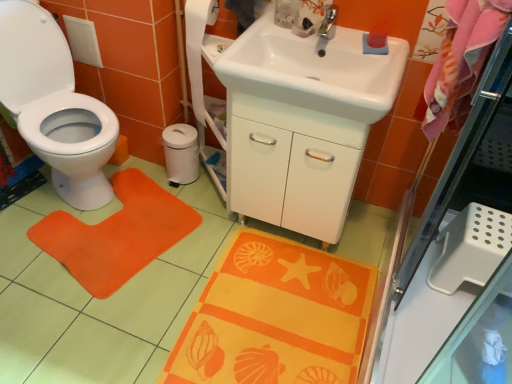
Question: Is white glossy sink at upper center, marked as the 2th sink in a back-to-front arrangement, with pink fabric beach towel at upper right?

Choices:
 (A) yes
 (B) no

Answer: (B)

Question: Does white glossy sink at upper center, marked as the 2th sink in a back-to-front arrangement, appear on the right side of pink fabric beach towel at upper right?

Choices:
 (A) yes
 (B) no

Answer: (B)

Question: From a real-world perspective, is white glossy sink at upper center, marked as the 2th sink in a back-to-front arrangement, on top of pink fabric beach towel at upper right?

Choices:
 (A) yes
 (B) no

Answer: (B)

Question: From a real-world perspective, is white glossy sink at upper center, marked as the 2th sink in a back-to-front arrangement, physically below pink fabric beach towel at upper right?

Choices:
 (A) yes
 (B) no

Answer: (A)

Question: Would you say white glossy sink at upper center, the 1th sink when ordered from front to back, contains pink fabric beach towel at upper right?

Choices:
 (A) yes
 (B) no

Answer: (B)

Question: Is white glossy sink at upper center, the 1th sink when ordered from front to back, positioned with its back to pink fabric beach towel at upper right?

Choices:
 (A) no
 (B) yes

Answer: (A)

Question: From a real-world perspective, is white glossy toilet at left on top of orange fabric bath mat at lower center?

Choices:
 (A) no
 (B) yes

Answer: (B)

Question: Is white glossy toilet at left to the left of orange fabric bath mat at lower center from the viewer's perspective?

Choices:
 (A) yes
 (B) no

Answer: (A)

Question: Is white glossy toilet at left aimed at orange fabric bath mat at lower center?

Choices:
 (A) yes
 (B) no

Answer: (A)

Question: Does white glossy toilet at left have a greater width compared to orange fabric bath mat at lower center?

Choices:
 (A) yes
 (B) no

Answer: (A)

Question: Does white glossy toilet at left have a smaller size compared to orange fabric bath mat at lower center?

Choices:
 (A) no
 (B) yes

Answer: (A)

Question: Is white glossy toilet at left further to camera compared to orange fabric bath mat at lower center?

Choices:
 (A) no
 (B) yes

Answer: (B)

Question: Is white glossy sink at center, the first sink viewed from the back, positioned with its back to white matte toilet paper at center?

Choices:
 (A) yes
 (B) no

Answer: (B)